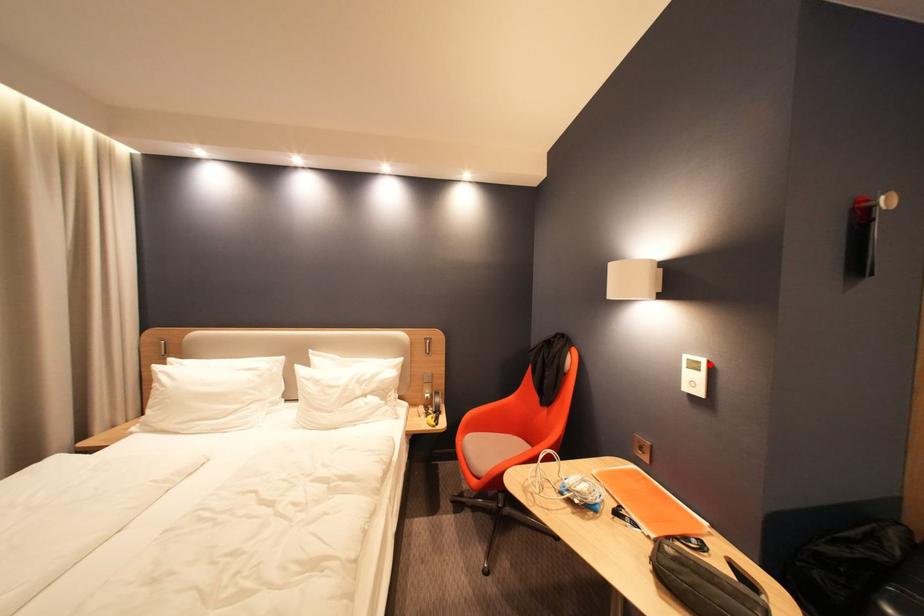
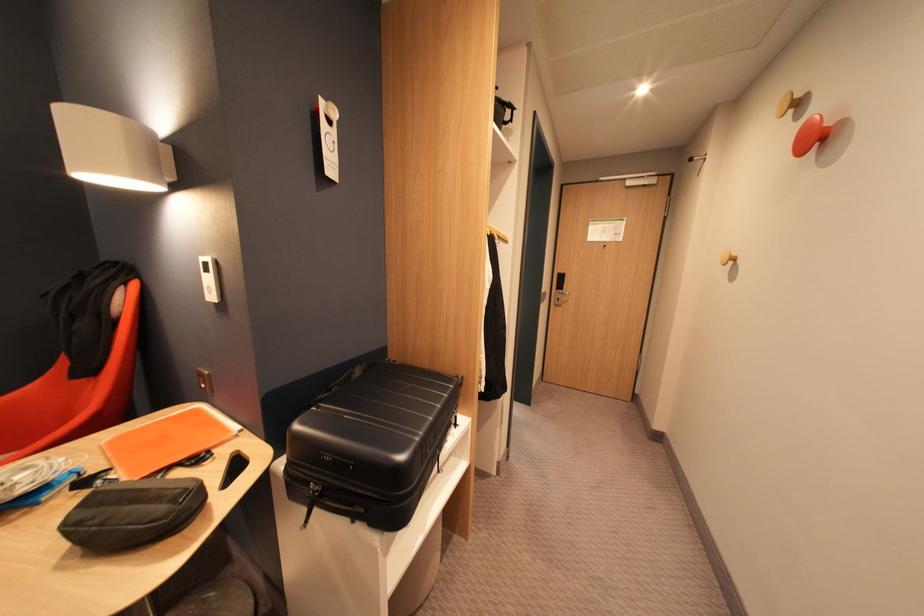
Where in the second image is the point corresponding to the highlighted location from the first image?

(216, 265)